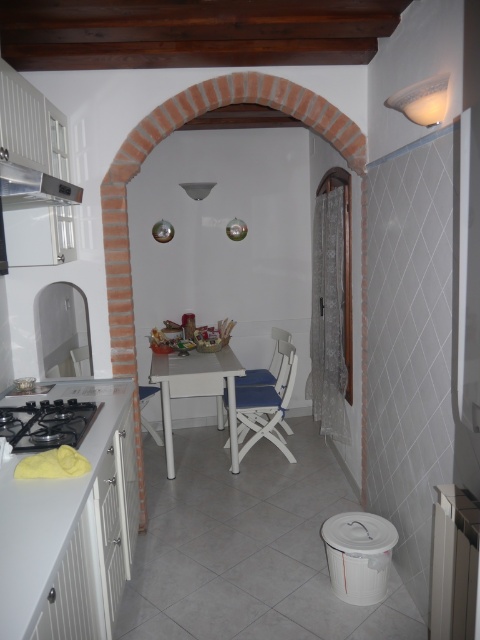
Which is more to the left, black matte stove at lower left or satin silver metallic exhaust hood at upper left?

Positioned to the left is satin silver metallic exhaust hood at upper left.

The image size is (480, 640). I want to click on black matte stove at lower left, so click(47, 422).

Image resolution: width=480 pixels, height=640 pixels. What do you see at coordinates (47, 422) in the screenshot?
I see `black matte stove at lower left` at bounding box center [47, 422].

The height and width of the screenshot is (640, 480). Identify the location of black matte stove at lower left. (47, 422).

Who is taller, blue fabric chair at center or satin silver metallic exhaust hood at upper left?

blue fabric chair at center is taller.

Does blue fabric chair at center appear under satin silver metallic exhaust hood at upper left?

Yes.

Does point (264, 388) lie in front of point (0, 173)?

No, (264, 388) is behind (0, 173).

Find the location of a particular element. blue fabric chair at center is located at coordinates (266, 404).

In the scene shown: Between black matte stove at lower left and blue fabric chair at center, which one has less height?

black matte stove at lower left is shorter.

Is point (58, 404) closer to camera compared to point (283, 380)?

Yes, it is.

In order to click on black matte stove at lower left in this screenshot , I will do `click(47, 422)`.